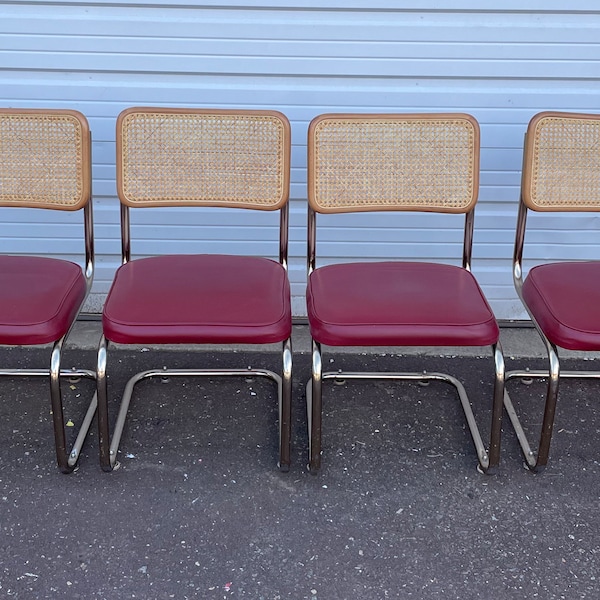
The height and width of the screenshot is (600, 600). What are the coordinates of `chair` in the screenshot? It's located at (417, 318).